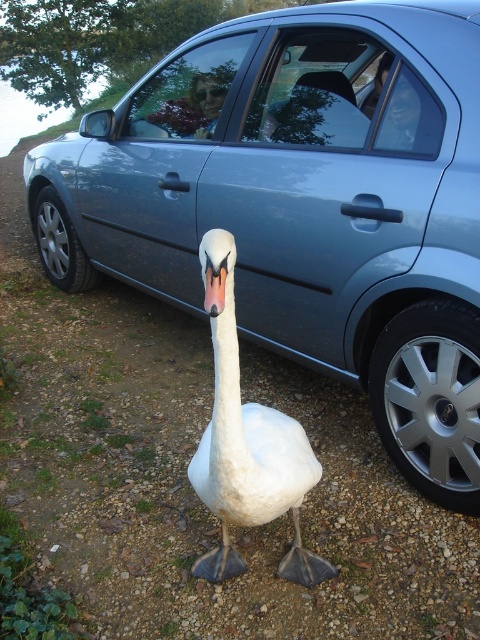
Can you confirm if silver metallic tire at left is shorter than white matte beak at center?

No.

Who is positioned more to the right, silver metallic tire at left or white matte beak at center?

From the viewer's perspective, white matte beak at center appears more on the right side.

Is point (75, 284) farther from camera compared to point (222, 273)?

That is True.

Where is `silver metallic tire at left`? Image resolution: width=480 pixels, height=640 pixels. silver metallic tire at left is located at coordinates (60, 244).

Looking at this image, between white feathered swan at center and white matte beak at center, which one appears on the left side from the viewer's perspective?

white matte beak at center

Is point (277, 515) in front of point (208, 307)?

No.

Where is `white feathered swan at center`? This screenshot has height=640, width=480. white feathered swan at center is located at coordinates (249, 451).

Based on the photo, can you confirm if silver metallic wheel at lower right is shorter than silver metallic tire at left?

In fact, silver metallic wheel at lower right may be taller than silver metallic tire at left.

Can you confirm if silver metallic wheel at lower right is positioned to the left of silver metallic tire at left?

In fact, silver metallic wheel at lower right is to the right of silver metallic tire at left.

In order to click on silver metallic wheel at lower right in this screenshot , I will do `click(431, 397)`.